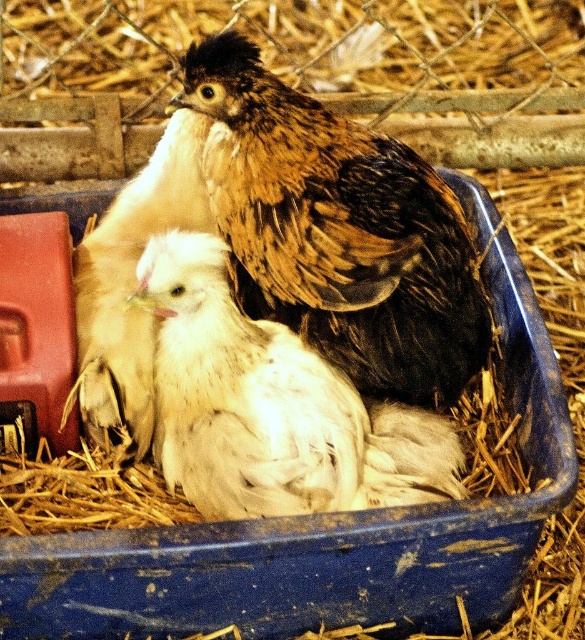
Question: Does brown feathered chicken at center appear on the left side of white fluffy chick at center?

Choices:
 (A) no
 (B) yes

Answer: (A)

Question: Which is farther from the white fluffy chicken at center?

Choices:
 (A) white fluffy chick at center
 (B) brown feathered chicken at center

Answer: (B)

Question: Which of the following is the farthest from the observer?

Choices:
 (A) (394, 436)
 (B) (331, 323)
 (C) (137, 364)

Answer: (C)

Question: Is brown feathered chicken at center thinner than white fluffy chick at center?

Choices:
 (A) yes
 (B) no

Answer: (B)

Question: Estimate the real-world distances between objects in this image. Which object is closer to the white fluffy chick at center?

Choices:
 (A) brown feathered chicken at center
 (B) white fluffy chicken at center

Answer: (A)

Question: Is brown feathered chicken at center wider than white fluffy chick at center?

Choices:
 (A) no
 (B) yes

Answer: (B)